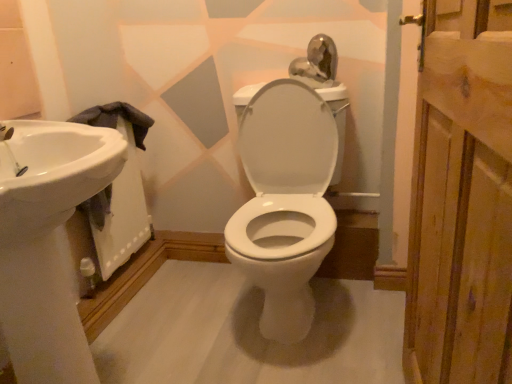
Question: Would you say white glossy sink at left is to the left or to the right of wooden plank at right in the picture?

Choices:
 (A) left
 (B) right

Answer: (A)

Question: Considering the positions of white glossy sink at left and wooden plank at right in the image, is white glossy sink at left wider or thinner than wooden plank at right?

Choices:
 (A) wide
 (B) thin

Answer: (B)

Question: Which object is positioned farthest from the white glossy sink at left?

Choices:
 (A) wooden plank at right
 (B) white glossy sink at left

Answer: (A)

Question: Which is farther from the wooden plank at right?

Choices:
 (A) white glossy sink at left
 (B) white glossy sink at left

Answer: (B)